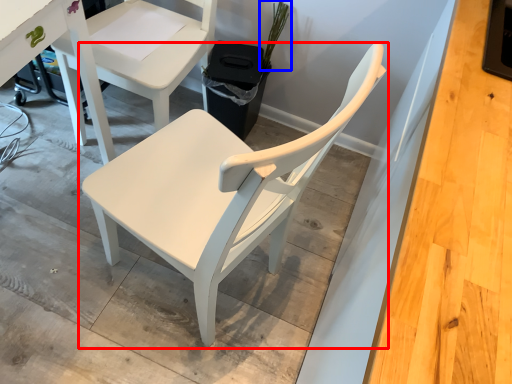
Question: Which of the following is the farthest to the observer, chair (highlighted by a red box) or plant (highlighted by a blue box)?

Choices:
 (A) chair
 (B) plant

Answer: (B)